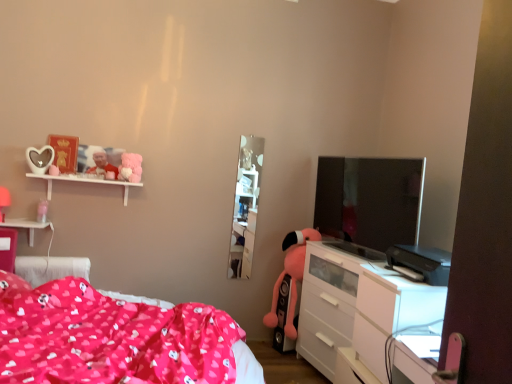
The image size is (512, 384). Find the location of `empty space that is ontop of white matte shelf at upper left (from a real-world perspective)`. empty space that is ontop of white matte shelf at upper left (from a real-world perspective) is located at coordinates (84, 175).